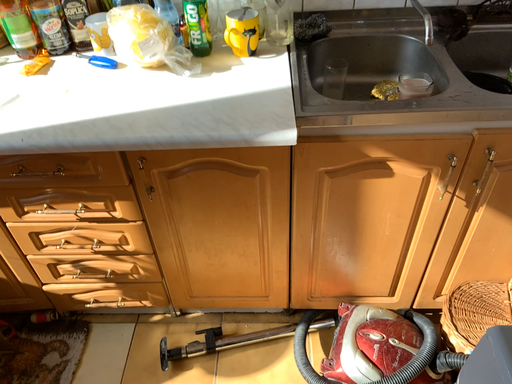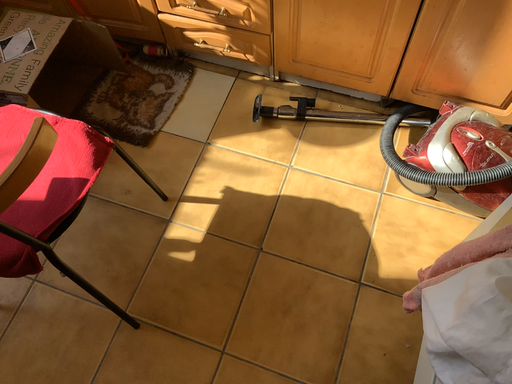
Question: How did the camera likely rotate when shooting the video?

Choices:
 (A) rotated left
 (B) rotated right

Answer: (A)